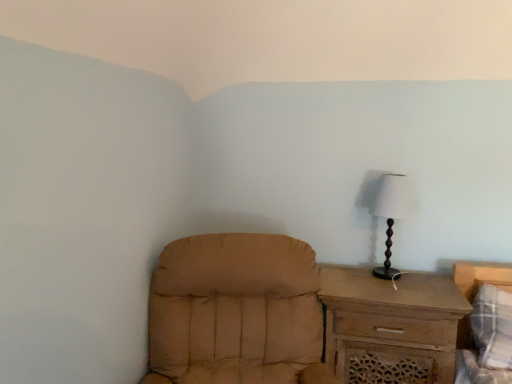
At what (x,y) coordinates should I click in order to perform the action: click on vacant area that lies to the right of white fabric lampshade at right. Please return your answer as a coordinate pair (x, y). Looking at the image, I should click on (424, 278).